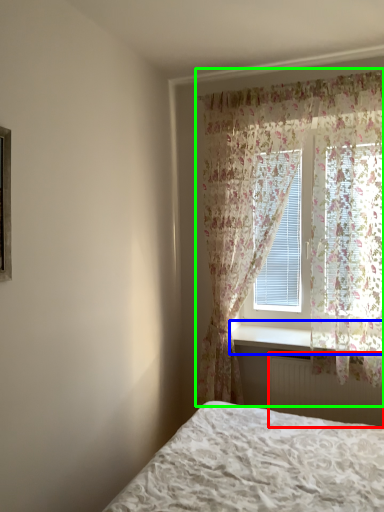
Question: Considering the real-world distances, which object is farthest from radiator (highlighted by a red box)? window sill (highlighted by a blue box) or curtain (highlighted by a green box)?

Choices:
 (A) window sill
 (B) curtain

Answer: (B)